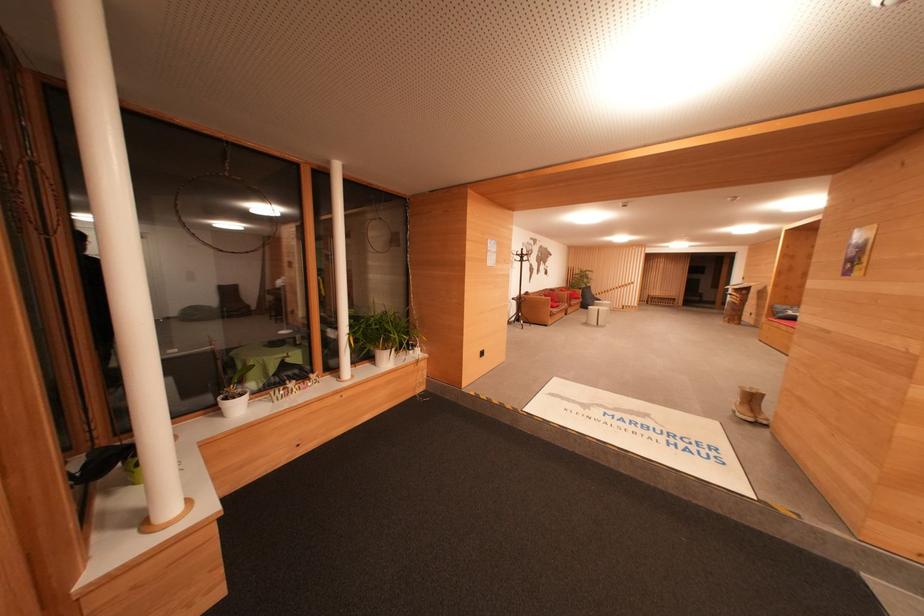
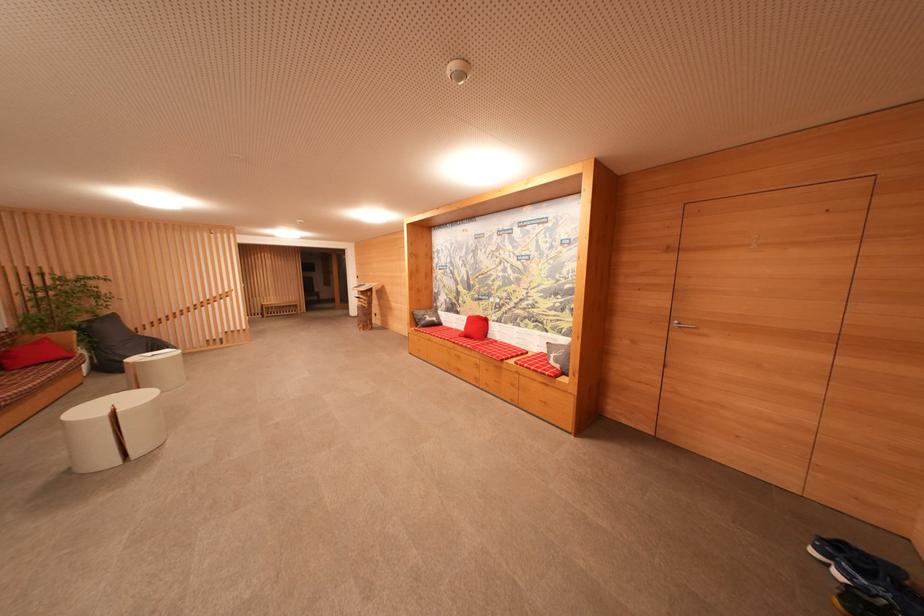
In the second image, find the point that corresponds to (x=795, y=315) in the first image.

(432, 322)